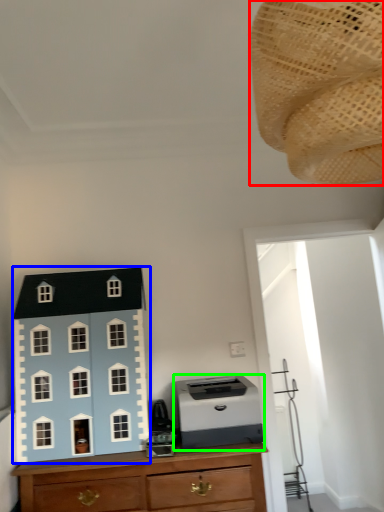
Question: Which object is the closest to the toy (highlighted by a red box)? Choose among these: toy (highlighted by a blue box) or printer (highlighted by a green box).

Choices:
 (A) toy
 (B) printer

Answer: (B)